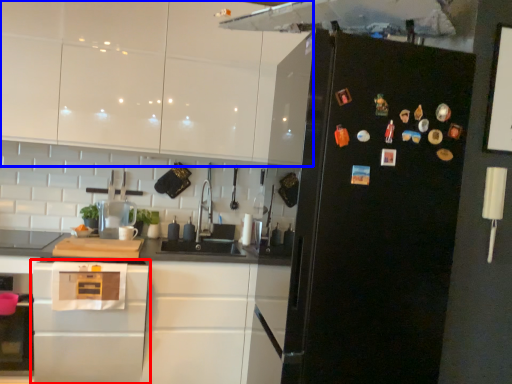
Question: Which object is closer to the camera taking this photo, home appliance (highlighted by a red box) or cabinetry (highlighted by a blue box)?

Choices:
 (A) home appliance
 (B) cabinetry

Answer: (A)